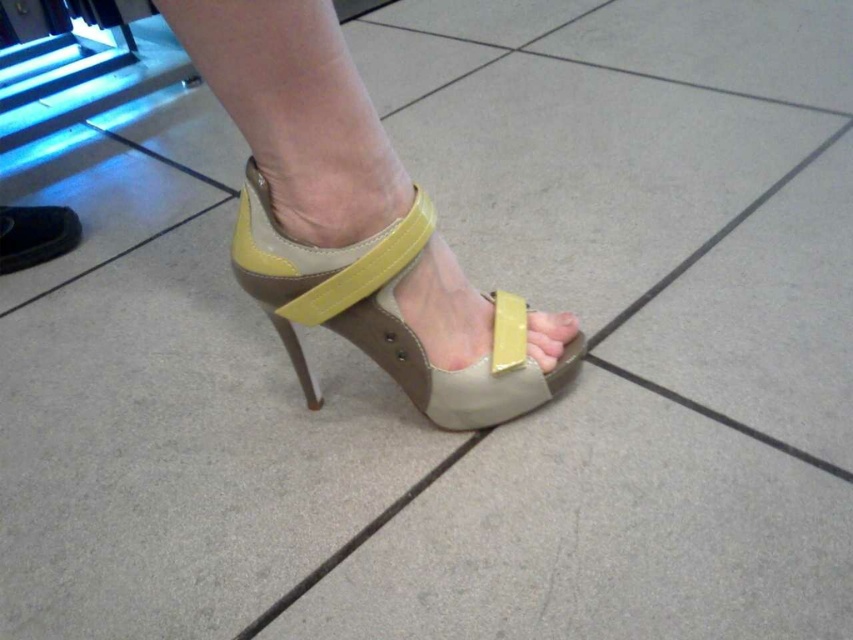
Question: Can you confirm if matte beige leather sandal at center is bigger than matte yellow leather high heel at lower center?

Choices:
 (A) no
 (B) yes

Answer: (B)

Question: Does matte beige leather sandal at center appear on the right side of matte yellow leather high heel at lower center?

Choices:
 (A) no
 (B) yes

Answer: (B)

Question: Does matte beige leather sandal at center appear on the right side of matte yellow leather high heel at lower center?

Choices:
 (A) yes
 (B) no

Answer: (A)